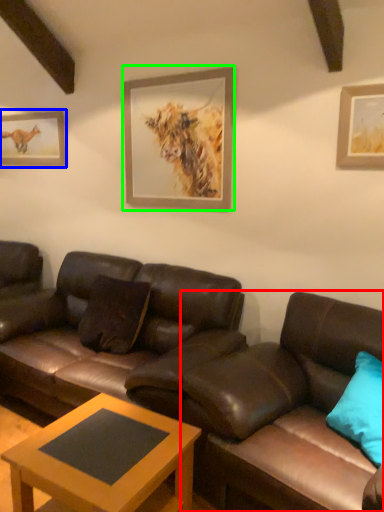
Question: Based on their relative distances, which object is farther from studio couch (highlighted by a red box)? Choose from picture frame (highlighted by a blue box) and picture frame (highlighted by a green box).

Choices:
 (A) picture frame
 (B) picture frame

Answer: (A)